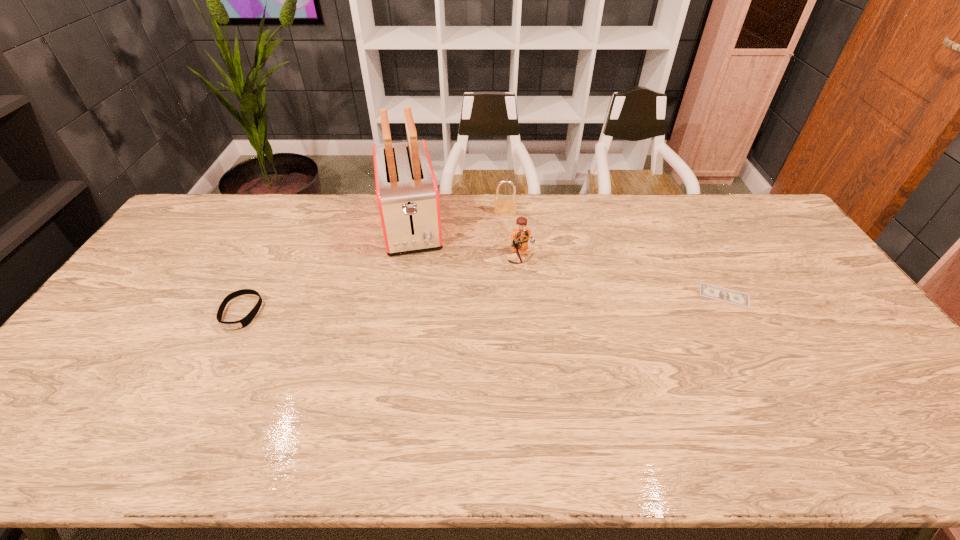
Identify the location of toaster positioned at the far edge. (407, 194).

At what (x,y) coordinates should I click in order to perform the action: click on free space at the far edge of the desktop. Please return your answer as a coordinate pair (x, y). Looking at the image, I should click on (278, 205).

This screenshot has height=540, width=960. I want to click on blank space at the near edge, so click(x=598, y=413).

At what (x,y) coordinates should I click in order to perform the action: click on vacant space at the left edge of the desktop. Please return your answer as a coordinate pair (x, y). Looking at the image, I should click on (109, 336).

In order to click on free space at the right edge in this screenshot , I will do `click(803, 272)`.

Where is `vacant space at the far left corner of the desktop`? The width and height of the screenshot is (960, 540). vacant space at the far left corner of the desktop is located at coordinates (237, 195).

In the image, there is a desktop. Identify the location of vacant space at the near left corner. (101, 407).

The image size is (960, 540). I want to click on free spot between the money and the padlock, so click(614, 254).

At what (x,y) coordinates should I click in order to perform the action: click on free area in between the tallest object and the padlock. Please return your answer as a coordinate pair (x, y). This screenshot has height=540, width=960. Looking at the image, I should click on (458, 219).

You are a GUI agent. You are given a task and a screenshot of the screen. Output one action in this format:
    pyautogui.click(x=<x>, y=<y>)
    Task: Click on the free spot between the second shortest object and the tallest object
    
    Given the screenshot: What is the action you would take?
    pyautogui.click(x=325, y=268)